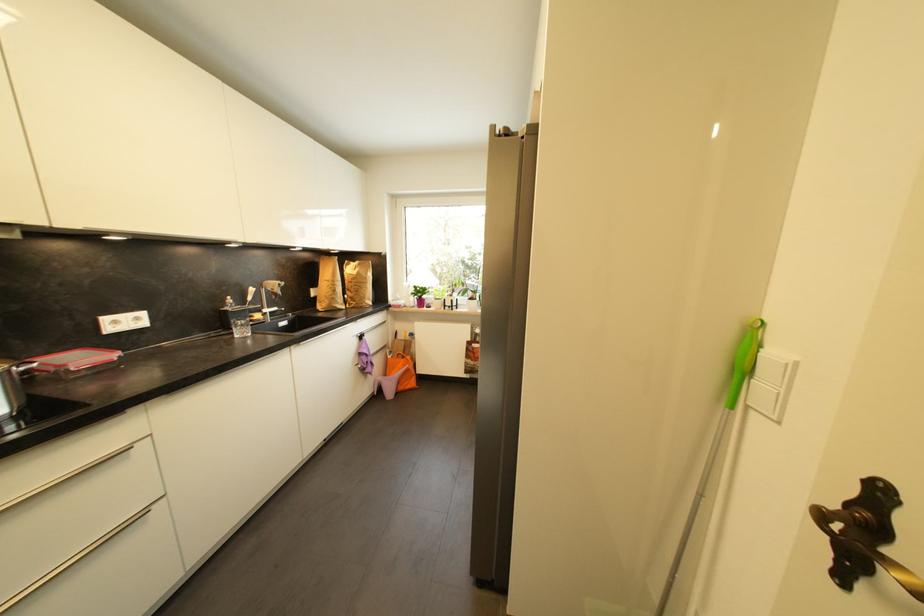
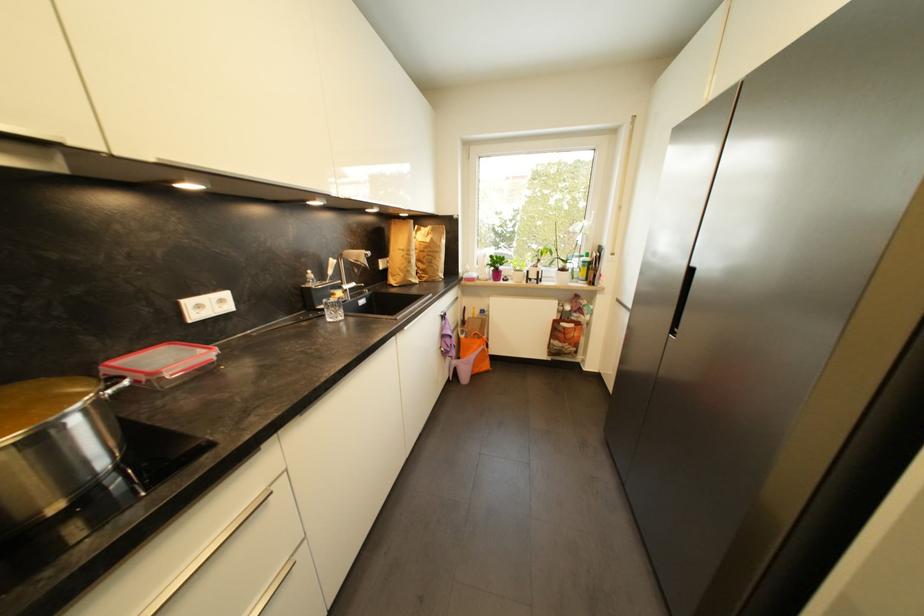
Find the pixel in the second image that matches the point at 274,309 in the first image.

(353, 285)